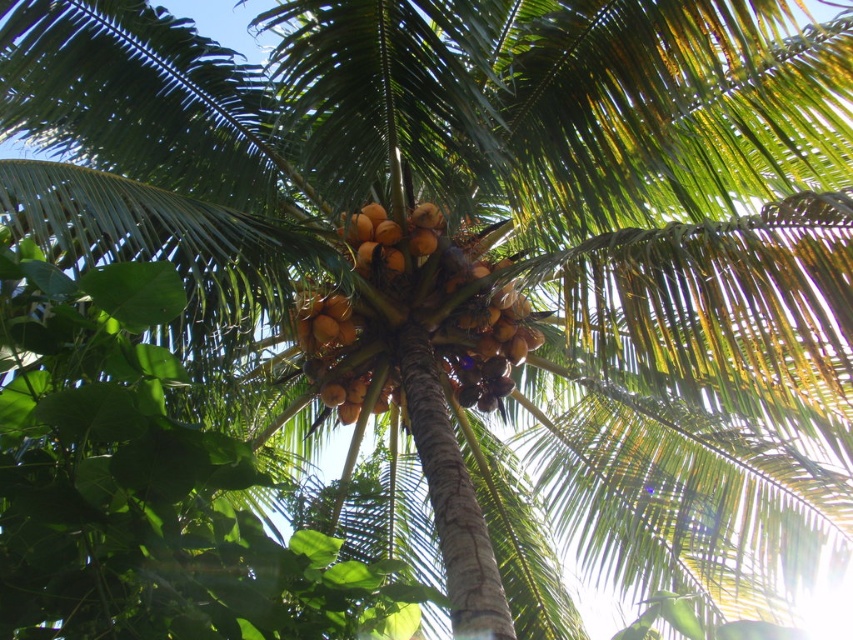
Question: Is yellowish brown coconuts at center thinner than brown rough coconut at center?

Choices:
 (A) yes
 (B) no

Answer: (B)

Question: Which point is closer to the camera?

Choices:
 (A) yellowish brown coconuts at center
 (B) brown rough coconut at center

Answer: (B)

Question: Does yellowish brown coconuts at center have a larger size compared to brown rough coconut at center?

Choices:
 (A) no
 (B) yes

Answer: (B)

Question: Which point is farther from the camera taking this photo?

Choices:
 (A) pos(328,298)
 (B) pos(384,228)

Answer: (B)

Question: Is yellowish brown coconuts at center above brown rough coconut at center?

Choices:
 (A) yes
 (B) no

Answer: (B)

Question: Which object is farther from the camera taking this photo?

Choices:
 (A) brown rough coconut at center
 (B) yellowish brown coconuts at center

Answer: (B)